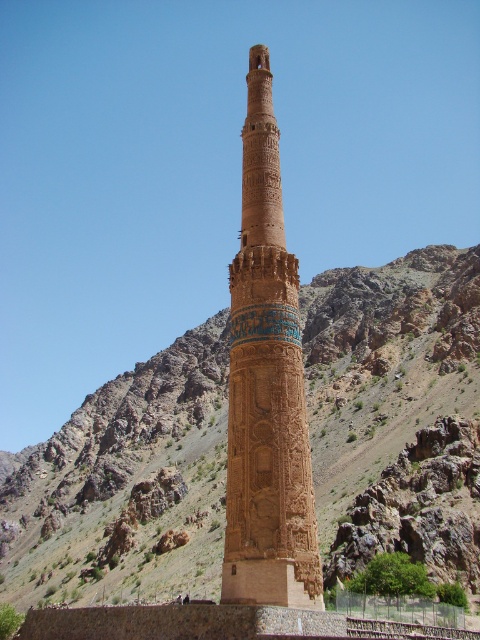
You are a hiker planning to take a photo of the brown stone minaret at center and the brown rocky mountain at center from a distance. Which object will appear wider in the photo?

The brown rocky mountain at center will appear wider in the photo since its width surpasses that of the brown stone minaret at center according to the description.

You are a hiker standing at the base of the brown rocky mountain at center and want to reach the top of the brown stone minaret at center. Which direction should you look to see the minaret?

The brown rocky mountain at center is below the brown stone minaret at center, so you should look upward to see the minaret.

You are standing at the base of the minaret and looking towards the center of the image. What can you see at the coordinates point (394, 403)?

At point (394, 403) lies brown rocky mountain at center.